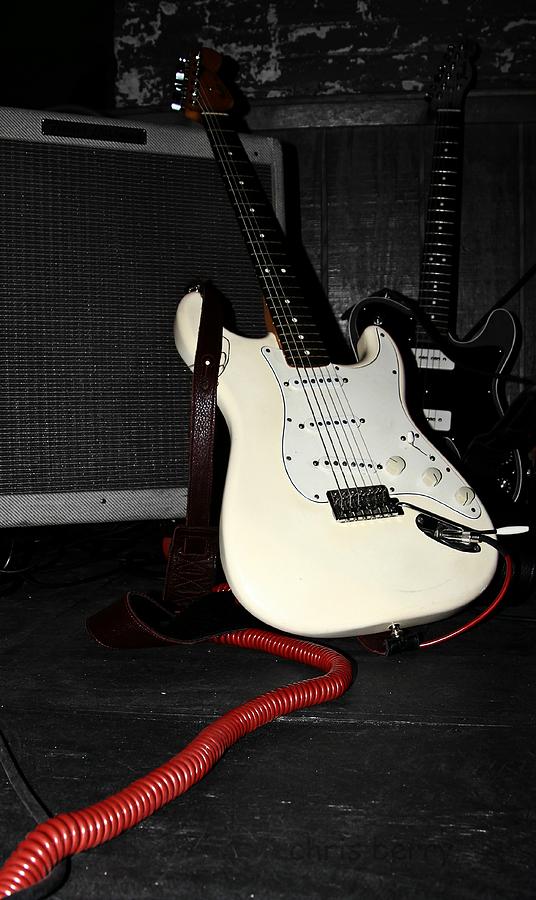
Find the location of a particular element. This screenshot has height=900, width=536. wall is located at coordinates (331, 65).